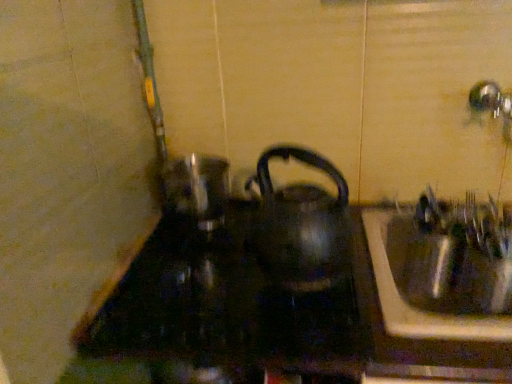
Question: Is black glossy kettle at center at the back of black glass stove at center?

Choices:
 (A) yes
 (B) no

Answer: (B)

Question: From a real-world perspective, does black glass stove at center sit lower than black glossy kettle at center?

Choices:
 (A) yes
 (B) no

Answer: (A)

Question: Would you say black glass stove at center is outside black glossy kettle at center?

Choices:
 (A) yes
 (B) no

Answer: (A)

Question: Considering the relative sizes of black glass stove at center and black glossy kettle at center in the image provided, is black glass stove at center smaller than black glossy kettle at center?

Choices:
 (A) yes
 (B) no

Answer: (B)

Question: Is black glass stove at center bigger than black glossy kettle at center?

Choices:
 (A) yes
 (B) no

Answer: (A)

Question: In terms of height, does black glass stove at center look taller or shorter compared to black glossy kettle at center?

Choices:
 (A) tall
 (B) short

Answer: (B)

Question: From a real-world perspective, is black glass stove at center above or below black glossy kettle at center?

Choices:
 (A) above
 (B) below

Answer: (B)

Question: From the image's perspective, relative to black glossy kettle at center, is black glass stove at center above or below?

Choices:
 (A) below
 (B) above

Answer: (A)

Question: Is black glass stove at center wider or thinner than black glossy kettle at center?

Choices:
 (A) wide
 (B) thin

Answer: (A)

Question: In terms of size, does black glass stove at center appear bigger or smaller than metallic sink at right?

Choices:
 (A) small
 (B) big

Answer: (B)

Question: From the image's perspective, relative to metallic sink at right, is black glass stove at center above or below?

Choices:
 (A) above
 (B) below

Answer: (A)

Question: Considering their positions, is black glass stove at center located in front of or behind metallic sink at right?

Choices:
 (A) behind
 (B) front

Answer: (B)

Question: Is black glass stove at center taller or shorter than metallic sink at right?

Choices:
 (A) tall
 (B) short

Answer: (B)

Question: Considering their positions, is metallic sink at right located in front of or behind black glass stove at center?

Choices:
 (A) behind
 (B) front

Answer: (A)

Question: From a real-world perspective, is metallic sink at right above or below black glass stove at center?

Choices:
 (A) above
 (B) below

Answer: (B)